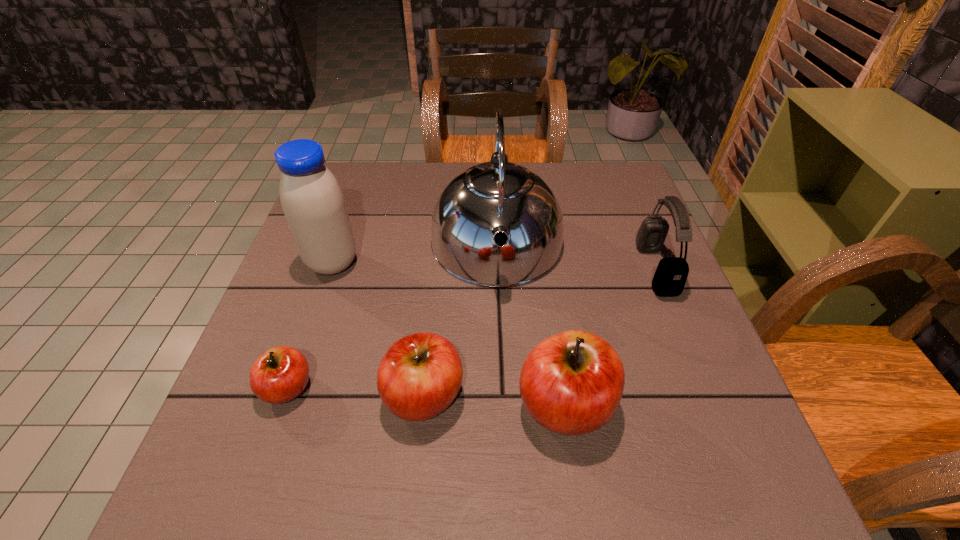
Find the location of `free point that keeps the apples evenly spaced on the right`. free point that keeps the apples evenly spaced on the right is located at coordinates (710, 414).